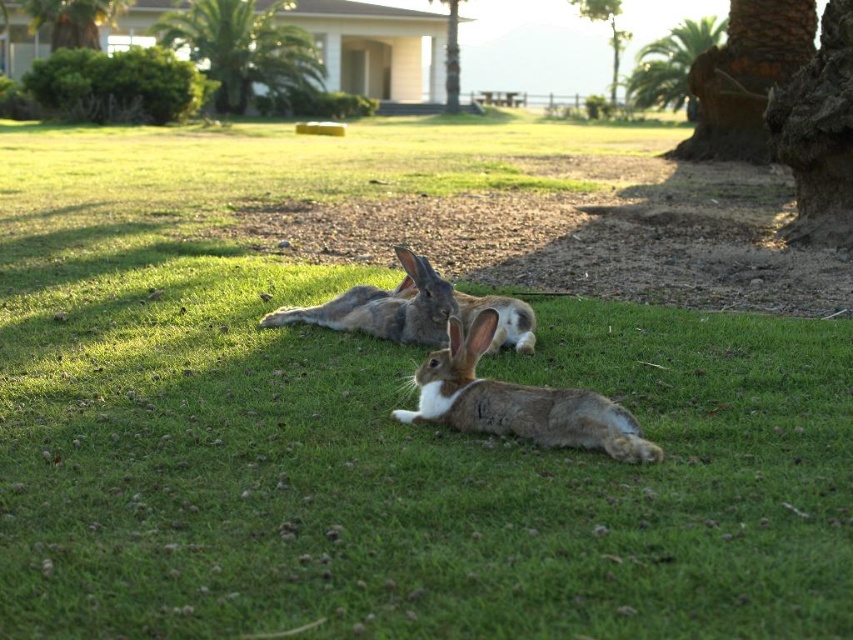
Based on the photo, you are planning to place a small garden statue between the green leafy palm tree at upper center and the green leafy palm tree at upper left. The statue requires a minimum of 8 feet of space to be placed safely. Based on the scene, can you determine if there is enough space between these two palm trees to place the statue?

The distance between the green leafy palm tree at upper center and the green leafy palm tree at upper left is 9.18 feet, which is more than the required 8 feet. Therefore, there is enough space to place the statue between them.